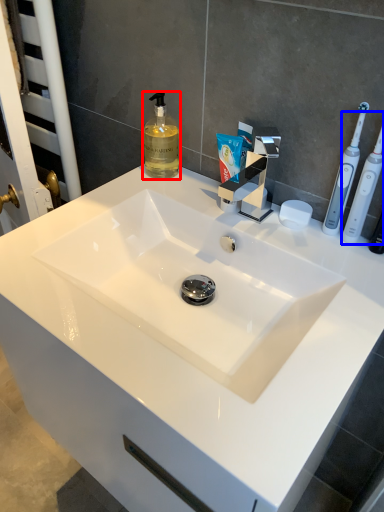
Question: Which object is closer to the camera taking this photo, soap dispenser (highlighted by a red box) or toothbrush (highlighted by a blue box)?

Choices:
 (A) soap dispenser
 (B) toothbrush

Answer: (B)